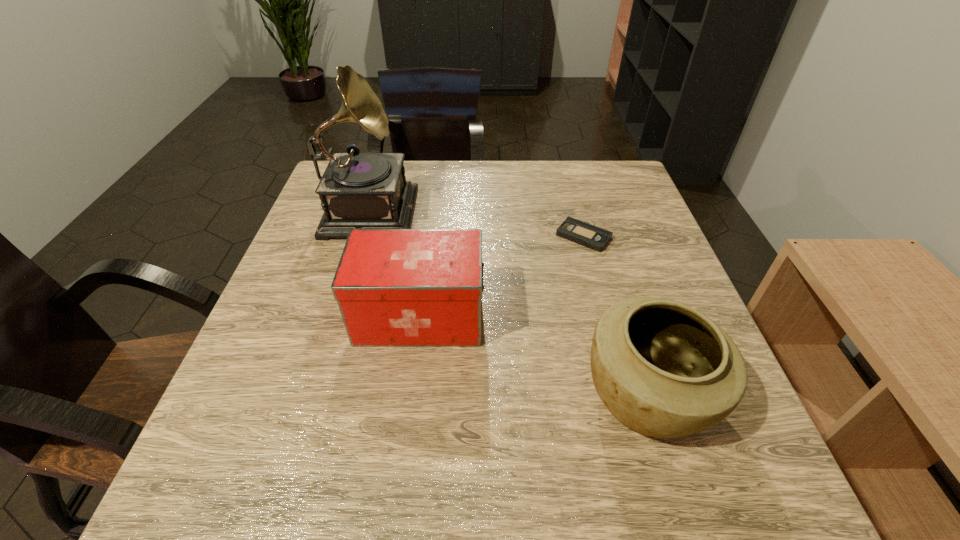
Image resolution: width=960 pixels, height=540 pixels. Identify the location of record player. (358, 190).

Locate an element on the screen. The width and height of the screenshot is (960, 540). the first-aid kit is located at coordinates (394, 287).

Identify the location of pottery. The image size is (960, 540). (663, 369).

The height and width of the screenshot is (540, 960). Identify the location of the shortest object. (593, 237).

In order to click on vacant space located 0.060m on the horn of the tallest object in this screenshot , I will do pyautogui.click(x=439, y=207).

Locate an element on the screen. The image size is (960, 540). vacant region located 0.330m on the handle side of the first-aid kit is located at coordinates (651, 316).

Where is `vacant space situated 0.090m on the back of the pottery`? vacant space situated 0.090m on the back of the pottery is located at coordinates (620, 307).

Where is `vacant space located 0.220m on the front of the videotape`? The image size is (960, 540). vacant space located 0.220m on the front of the videotape is located at coordinates (608, 327).

What are the coordinates of `object present at the far edge` in the screenshot? It's located at (358, 190).

This screenshot has width=960, height=540. Find the location of `object that is at the near edge`. object that is at the near edge is located at coordinates (663, 369).